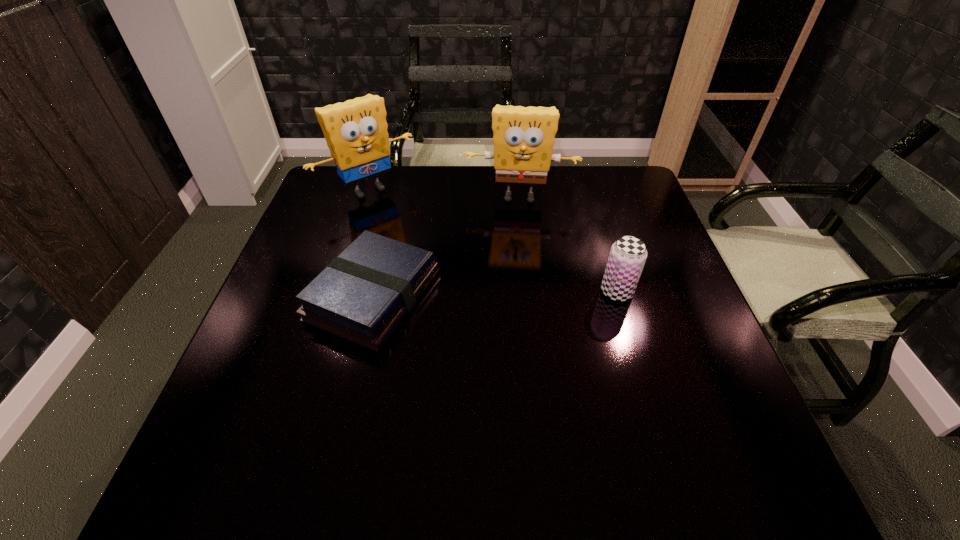
Identify the location of free space on the desktop that is between the shortest object and the rightmost object and is positioned on the face of the left sponge. (466, 294).

This screenshot has width=960, height=540. Identify the location of free space on the desktop that is between the shortest object and the beer can and is positioned on the face of the right sponge. (516, 293).